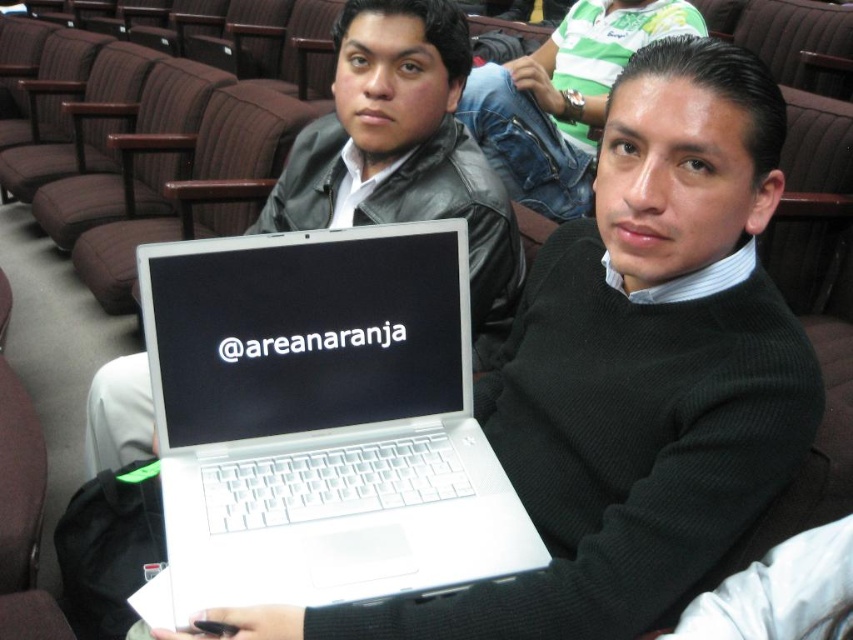
Question: Can you confirm if white plastic laptop at center is thinner than white matte laptop at center?

Choices:
 (A) no
 (B) yes

Answer: (B)

Question: Which object appears farthest from the camera in this image?

Choices:
 (A) white matte laptop at center
 (B) white plastic laptop at center

Answer: (A)

Question: Considering the relative positions of white plastic laptop at center and white matte laptop at center in the image provided, where is white plastic laptop at center located with respect to white matte laptop at center?

Choices:
 (A) left
 (B) right

Answer: (B)

Question: Is white plastic laptop at center thinner than white matte laptop at center?

Choices:
 (A) no
 (B) yes

Answer: (B)

Question: Which of the following is the closest to the observer?

Choices:
 (A) white plastic laptop at center
 (B) white matte laptop at center

Answer: (A)